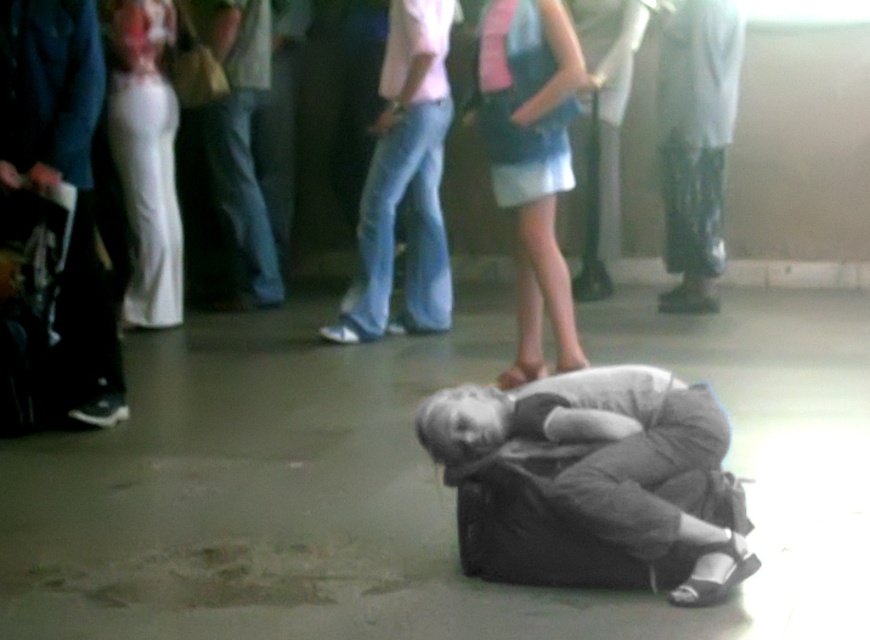
Question: Which object appears closest to the camera in this image?

Choices:
 (A) white satin dress at left
 (B) denim jeans at center
 (C) dark blue jeans at left

Answer: (C)

Question: Which point appears farthest from the camera in this image?

Choices:
 (A) (x=661, y=524)
 (B) (x=112, y=113)
 (C) (x=185, y=51)

Answer: (C)

Question: Based on their relative distances, which object is nearer to the white matte boots at right?

Choices:
 (A) blue denim skirt at center
 (B) dark blue jeans at left
 (C) denim jeans at center
 (D) white satin dress at left

Answer: (A)

Question: Does light blue denim jeans at center appear over white satin dress at left?

Choices:
 (A) no
 (B) yes

Answer: (A)

Question: Can you confirm if dark gray fabric bag at center is positioned above white satin dress at left?

Choices:
 (A) no
 (B) yes

Answer: (A)

Question: Is light blue denim jeans at center bigger than denim jeans at center?

Choices:
 (A) no
 (B) yes

Answer: (B)